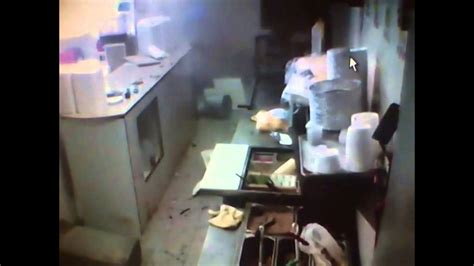
The image size is (474, 266). What are the coordinates of `wall` in the screenshot? It's located at (387, 75).